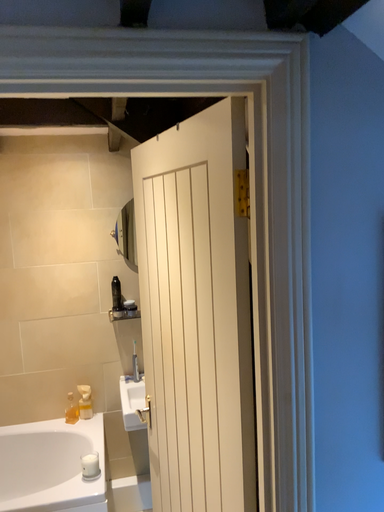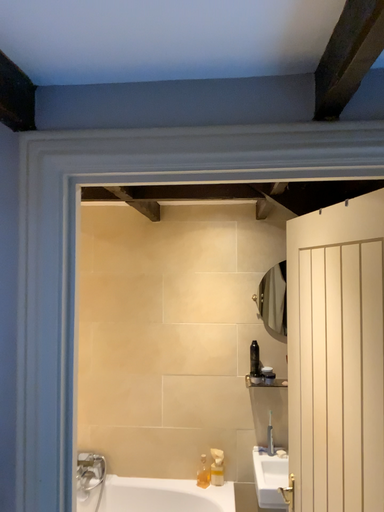
Question: Which way did the camera rotate in the video?

Choices:
 (A) rotated downward
 (B) rotated upward

Answer: (B)